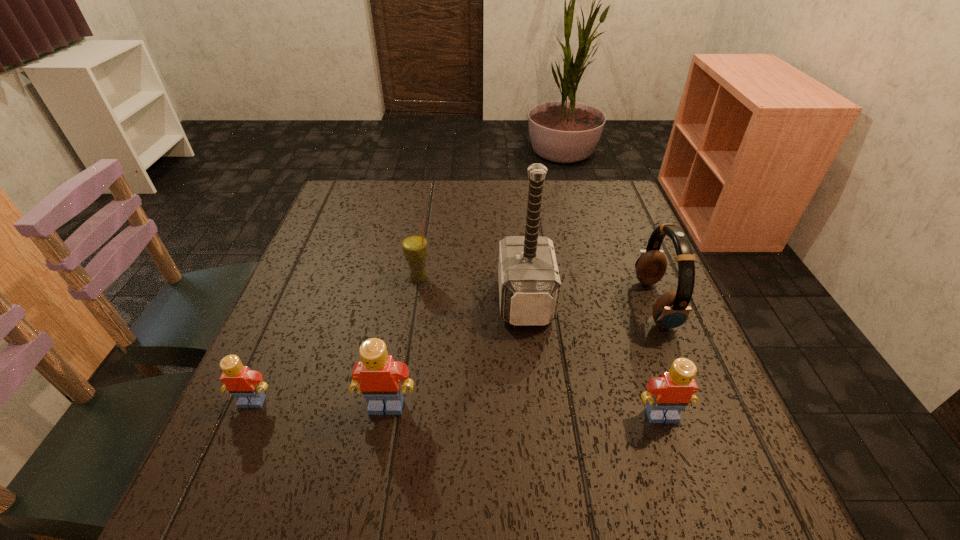
Locate an element on the screen. This screenshot has width=960, height=540. free space between the tallest object and the rightmost Lego is located at coordinates (593, 357).

The image size is (960, 540). What are the coordinates of `vacant space that is in between the headset and the leftmost Lego` in the screenshot? It's located at (453, 353).

Locate an element on the screen. vacant space that's between the second shortest Lego and the second Lego from right to left is located at coordinates (524, 410).

At what (x,y) coordinates should I click in order to perform the action: click on vacant point located between the second shortest Lego and the straw for drinking. Please return your answer as a coordinate pair (x, y). Looking at the image, I should click on (540, 347).

This screenshot has height=540, width=960. Identify the location of free point between the headset and the second Lego from right to left. (520, 355).

What are the coordinates of `vacant area that lies between the second Lego from left to right and the headset` in the screenshot? It's located at (520, 355).

Where is `empty space between the shortest Lego and the second Lego from right to left`? Image resolution: width=960 pixels, height=540 pixels. empty space between the shortest Lego and the second Lego from right to left is located at coordinates (320, 403).

The width and height of the screenshot is (960, 540). In order to click on free space between the hammer and the second shortest object in this screenshot , I will do `click(593, 357)`.

You are a GUI agent. You are given a task and a screenshot of the screen. Output one action in this format:
    pyautogui.click(x=<x>, y=<y>)
    Task: Click on the object that stands as the second closest to the headset
    The width and height of the screenshot is (960, 540).
    Given the screenshot: What is the action you would take?
    pyautogui.click(x=529, y=283)

Locate which object is the second closest to the shortest object. Please provide its 2D coordinates. Your answer should be formatted as a tuple, i.e. [(x, y)], where the tuple contains the x and y coordinates of a point satisfying the conditions above.

[(414, 246)]